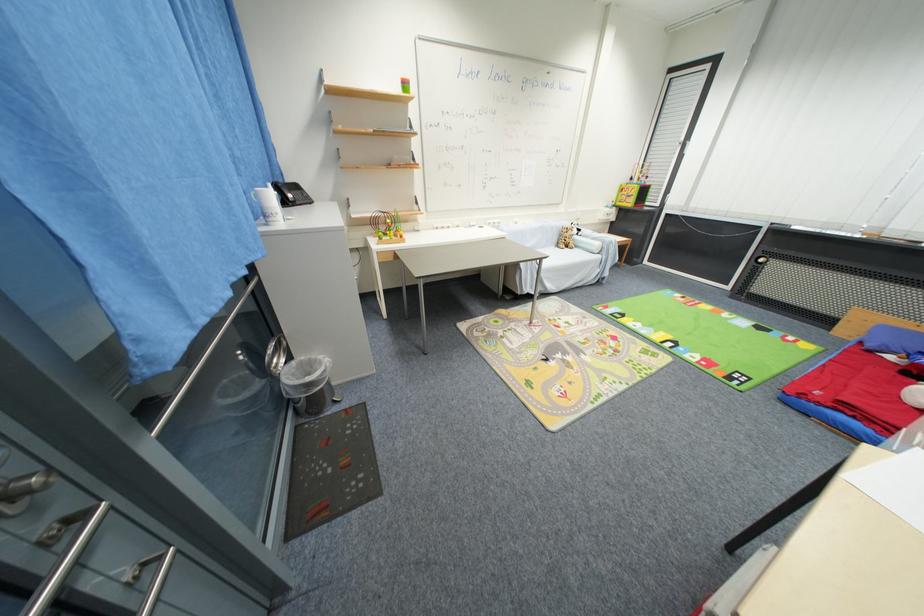
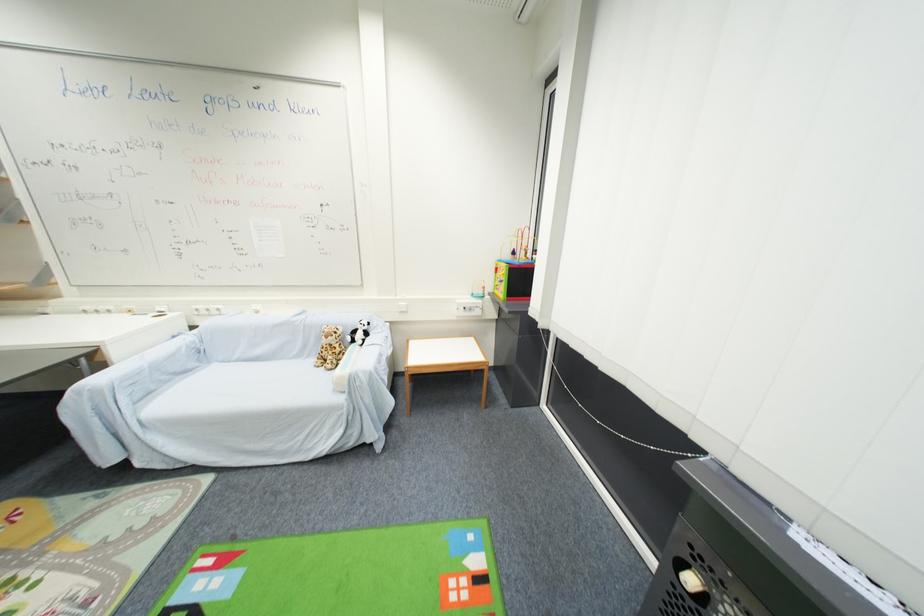
What movement of the cameraman would produce the second image?

The cameraman moved toward right, forward.